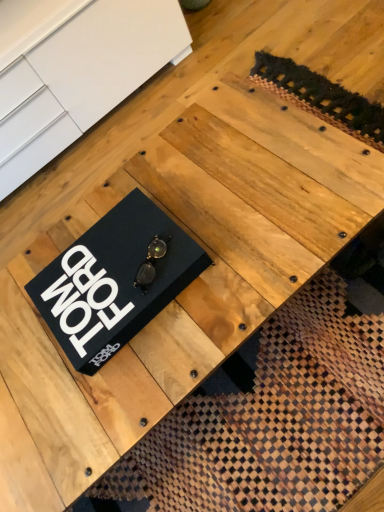
You are a GUI agent. You are given a task and a screenshot of the screen. Output one action in this format:
    pyautogui.click(x=<x>, y=<y>)
    Task: Click on the free space in front of black matte box at center
    Image resolution: width=384 pixels, height=512 pixels.
    Given the screenshot: What is the action you would take?
    pyautogui.click(x=149, y=369)